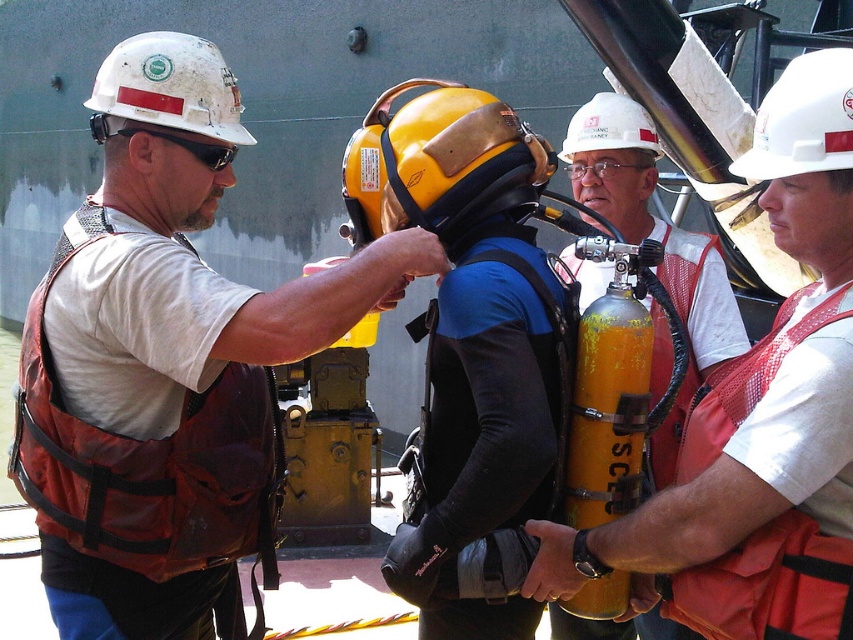
You are a safety inspector checking the setup for a diving operation. You notice the matte orange cylinder at center and the white hard hat at center. According to safety protocols, the cylinder must be placed to the right of the hard hat to avoid blocking the diver. Is the current arrangement compliant with safety standards?

The matte orange cylinder at center is positioned on the left side of white hard hat at center, which means it is not placed to the right as required. This arrangement does not comply with safety standards because the cylinder is blocking the diver.

You are a safety inspector checking the setup for a diving operation. You notice an orange mesh life vest at left and a camera. According to safety regulations, these two items must be within 3 meters of each other for quick access. Are they compliant?

The orange mesh life vest at left and camera are 2.94 meters apart from each other, which is within the 3 meter requirement. Therefore, they are compliant with safety regulations.